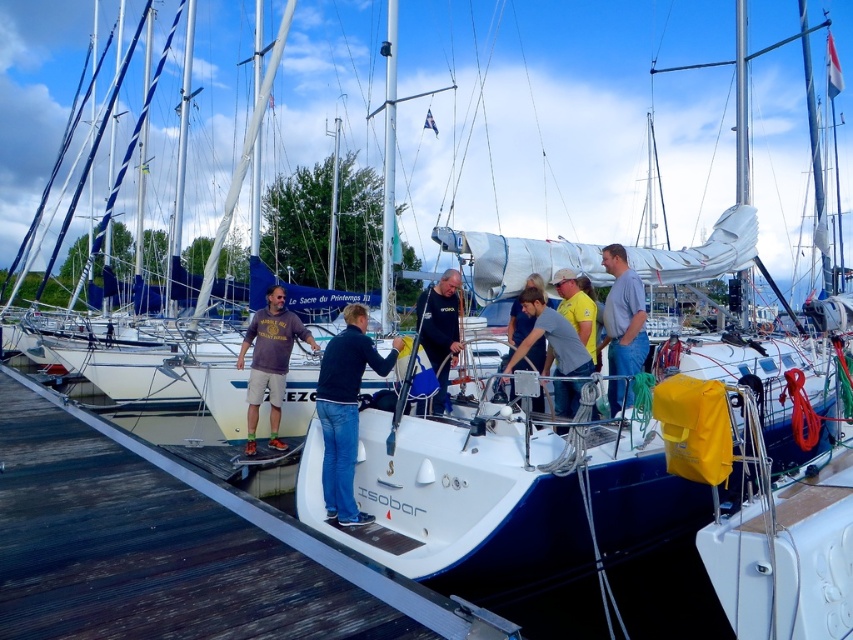
Question: Which of the following is the closest to the observer?

Choices:
 (A) (350, 465)
 (B) (521, 349)

Answer: (A)

Question: Is white wood dock at center thinner than white glossy mast at center?

Choices:
 (A) no
 (B) yes

Answer: (A)

Question: Does white wood dock at center have a lesser width compared to white matte mast at center?

Choices:
 (A) no
 (B) yes

Answer: (A)

Question: Among these objects, which one is nearest to the camera?

Choices:
 (A) white matte mast at center
 (B) white glossy mast at center

Answer: (A)

Question: Is white wood dock at center below white matte mast at center?

Choices:
 (A) yes
 (B) no

Answer: (A)

Question: Which is nearer to the white matte mast at center?

Choices:
 (A) gray matte shirt at center
 (B) white wood dock at center
 (C) light blue denim jeans at right

Answer: (C)